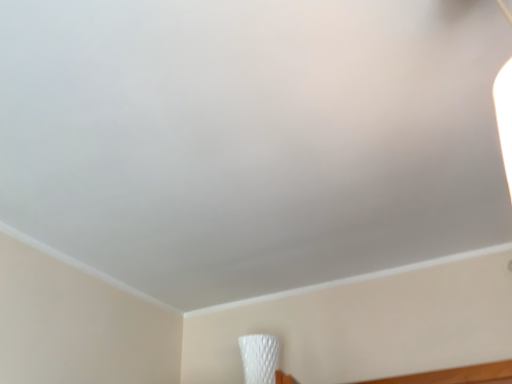
You are a GUI agent. You are given a task and a screenshot of the screen. Output one action in this format:
    pyautogui.click(x=<x>, y=<y>)
    Task: Click on the white textured lampshade at lower center
    The image size is (512, 384).
    Given the screenshot: What is the action you would take?
    pyautogui.click(x=259, y=358)

This screenshot has width=512, height=384. What do you see at coordinates (259, 358) in the screenshot?
I see `white textured lampshade at lower center` at bounding box center [259, 358].

Identify the location of white textured lampshade at lower center. (259, 358).